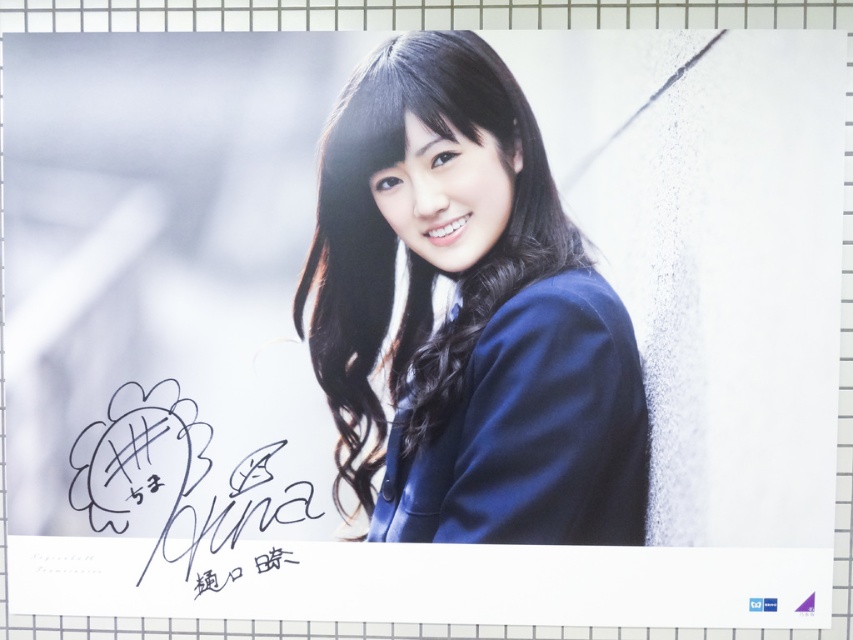
Which is more to the right, matte blue blazer at center or black ink signature at lower left?

matte blue blazer at center is more to the right.

Can you confirm if matte blue blazer at center is taller than black ink signature at lower left?

Yes.

Which is behind, point (532, 464) or point (180, 532)?

Positioned behind is point (180, 532).

Find the location of a particular element. matte blue blazer at center is located at coordinates (529, 429).

This screenshot has height=640, width=853. Describe the element at coordinates (468, 314) in the screenshot. I see `blue fabric jacket at center` at that location.

Which is below, blue fabric jacket at center or matte blue blazer at center?

matte blue blazer at center is lower down.

The height and width of the screenshot is (640, 853). Find the location of `blue fabric jacket at center`. blue fabric jacket at center is located at coordinates (468, 314).

Is blue fabric jacket at center above black ink signature at lower left?

Yes, blue fabric jacket at center is above black ink signature at lower left.

Is point (419, 301) positioned after point (102, 484)?

Yes.

This screenshot has width=853, height=640. In order to click on blue fabric jacket at center in this screenshot , I will do `click(468, 314)`.